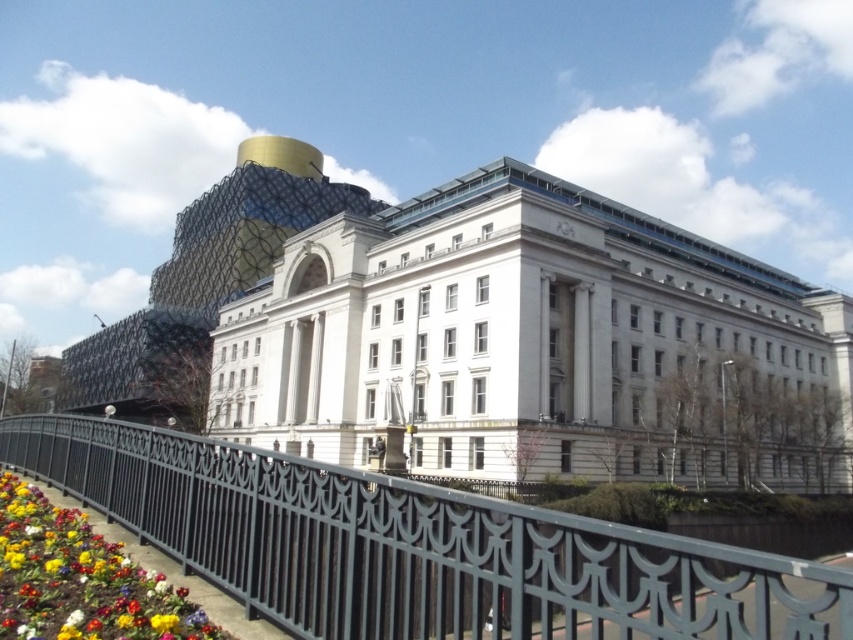
Question: Which of the following is the farthest from the observer?

Choices:
 (A) (354, 596)
 (B) (743, 262)
 (C) (213, 634)

Answer: (B)

Question: Can you confirm if white stone building at center is bigger than black wrought iron railing at center?

Choices:
 (A) yes
 (B) no

Answer: (A)

Question: Is black wrought iron railing at center thinner than multicolored fabric flower at lower left?

Choices:
 (A) yes
 (B) no

Answer: (B)

Question: Which object is farther from the camera taking this photo?

Choices:
 (A) black wrought iron railing at center
 (B) multicolored fabric flower at lower left
 (C) white stone building at center

Answer: (C)

Question: Can you confirm if black wrought iron railing at center is wider than multicolored fabric flower at lower left?

Choices:
 (A) yes
 (B) no

Answer: (A)

Question: Which of the following is the closest to the observer?

Choices:
 (A) black wrought iron railing at center
 (B) multicolored fabric flower at lower left
 (C) white stone building at center

Answer: (A)